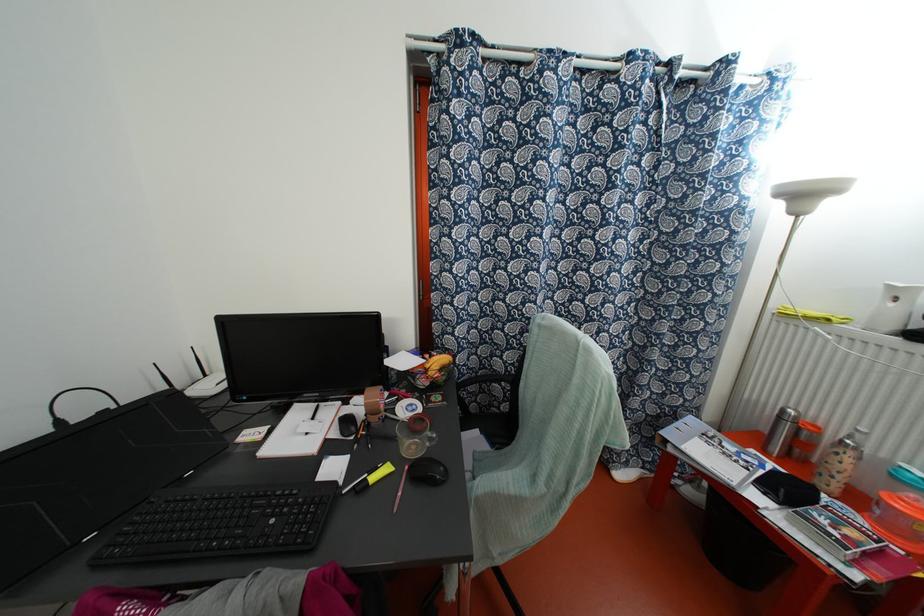
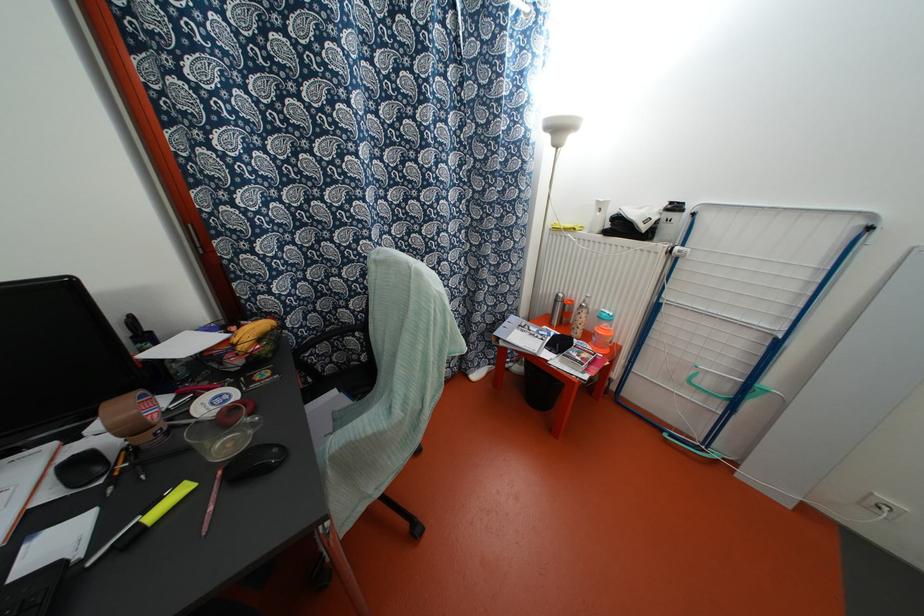
Find the pixel in the second image that matches (370,410) in the first image.

(131, 429)